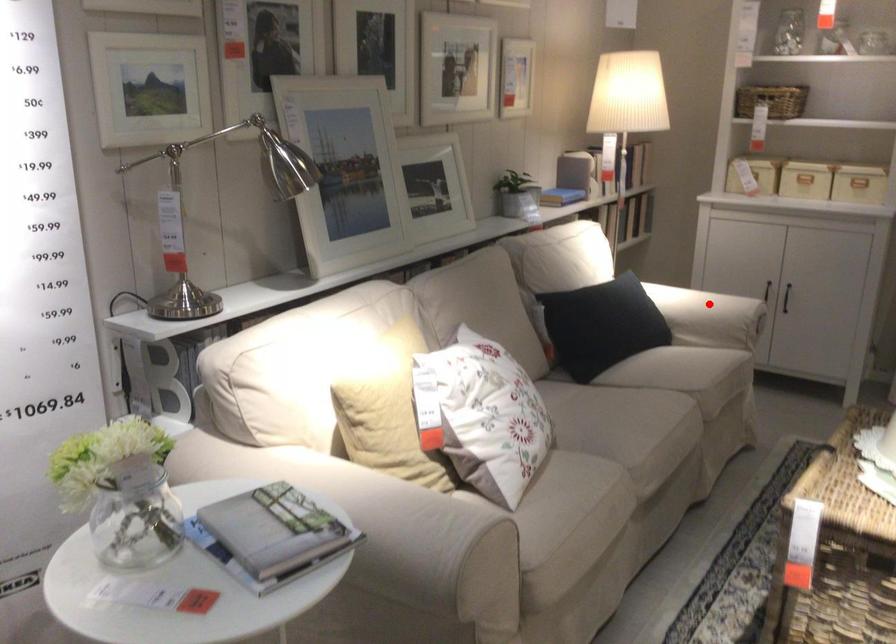
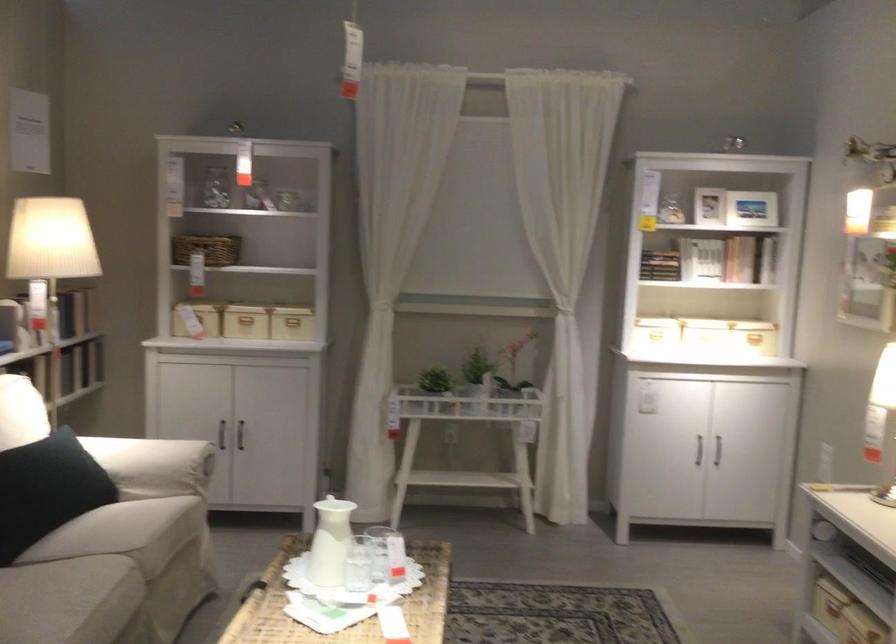
The point at the highlighted location is marked in the first image. Where is the corresponding point in the second image?

(152, 465)